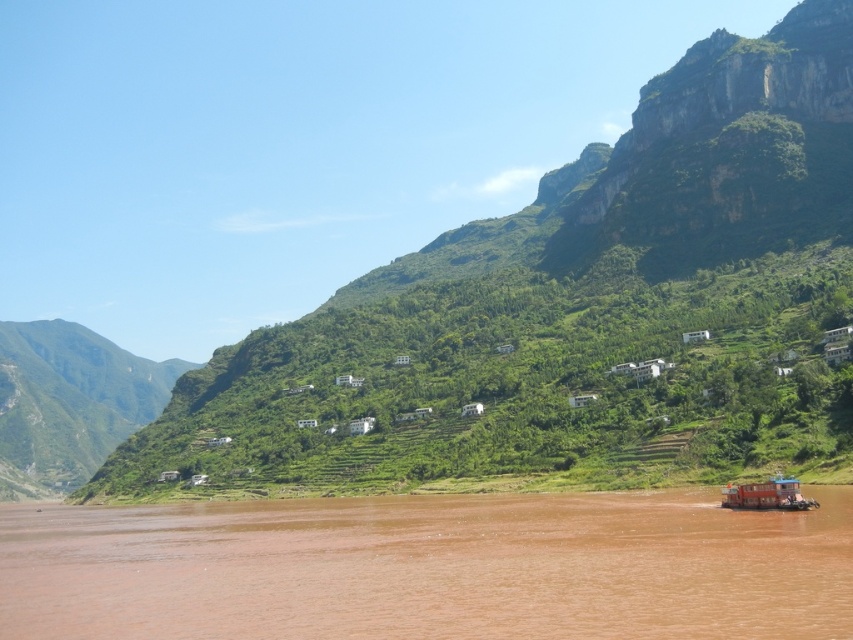
You are standing on a path between the brown muddy water at lower right and the green grassy hillside at left. Which one is nearer to you?

The brown muddy water at lower right is closer to the viewer than the green grassy hillside at left.